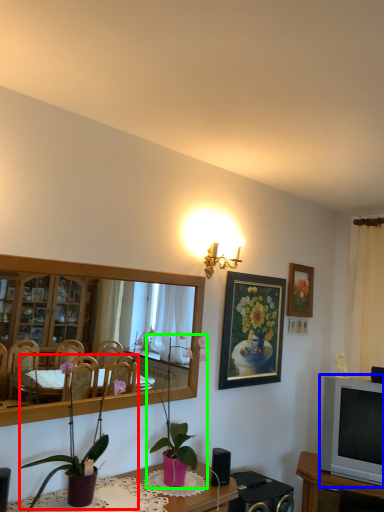
Question: Considering the real-world distances, which object is farthest from houseplant (highlighted by a red box)? television (highlighted by a blue box) or houseplant (highlighted by a green box)?

Choices:
 (A) television
 (B) houseplant

Answer: (A)